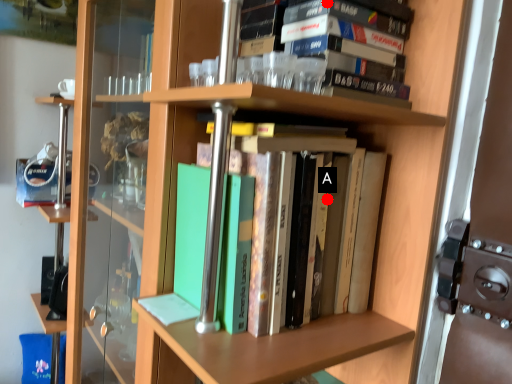
Question: Two points are circled on the image, labeled by A and B beside each circle. Which point is closer to the camera?

Choices:
 (A) A is closer
 (B) B is closer

Answer: (B)